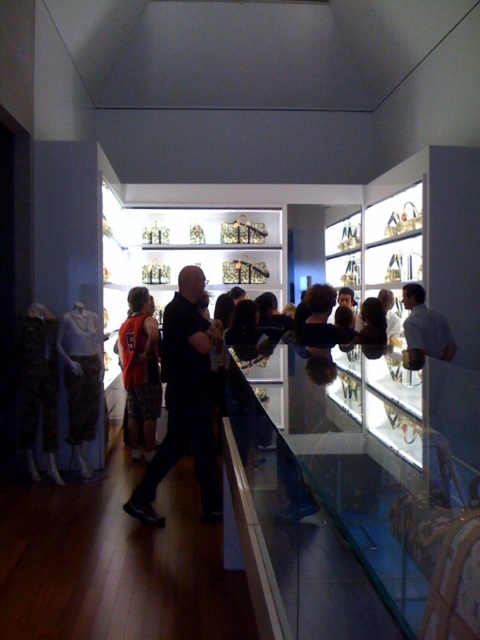
You are a visitor standing in the boutique and see the transparent glass case at center and the red plaid shorts at center. Which object is positioned higher in the scene?

The transparent glass case at center is located above the red plaid shorts at center, so it is positioned higher.

You are standing in the exhibit space and want to examine the red plaid shorts at center. The transparent glass case at center is in your way. Can you walk around it to get a better view?

The transparent glass case at center is closer to the viewer than the red plaid shorts at center, so you can walk around it to get a better view of the red plaid shorts at center.

You are standing in the exhibit space and want to touch the camouflage fabric pants at left and the white matte shirt at center. However, there is a glass barrier between you and the items. Which item can you reach first without moving your position?

The camouflage fabric pants at left can be reached first because it is closer to the viewer than the white matte shirt at center, so it is nearer to the glass barrier.